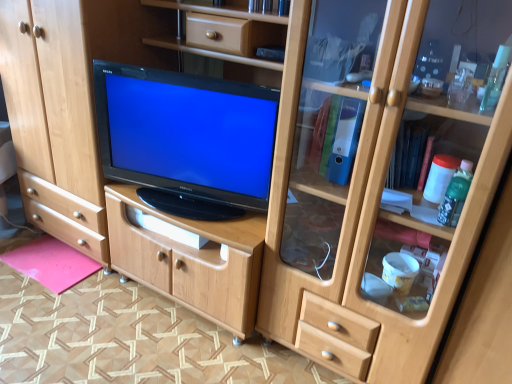
This screenshot has height=384, width=512. Identify the location of pink matte mat at lower left. (51, 263).

Describe the element at coordinates (51, 263) in the screenshot. I see `pink matte mat at lower left` at that location.

In order to click on black glossy television at center in this screenshot , I will do `click(186, 134)`.

Describe the element at coordinates (186, 134) in the screenshot. This screenshot has width=512, height=384. I see `black glossy television at center` at that location.

Locate an element on the screen. The image size is (512, 384). pink matte mat at lower left is located at coordinates (51, 263).

Is black glossy television at center to the left or to the right of pink matte mat at lower left in the image?

In the image, black glossy television at center appears on the right side of pink matte mat at lower left.

Based on the photo, considering the relative positions of black glossy television at center and pink matte mat at lower left in the image provided, is black glossy television at center behind pink matte mat at lower left?

No, it is in front of pink matte mat at lower left.

Is point (98, 126) closer or farther from the camera than point (63, 271)?

Point (98, 126).

From the image's perspective, between black glossy television at center and pink matte mat at lower left, which one is located above?

black glossy television at center appears higher in the image.

From a real-world perspective, which object rests below the other?

In real-world perspective, pink matte mat at lower left is lower.

Which object is thinner, black glossy television at center or pink matte mat at lower left?

black glossy television at center is thinner.

Considering the relative sizes of black glossy television at center and pink matte mat at lower left in the image provided, is black glossy television at center shorter than pink matte mat at lower left?

In fact, black glossy television at center may be taller than pink matte mat at lower left.

Considering the sizes of objects black glossy television at center and pink matte mat at lower left in the image provided, who is smaller, black glossy television at center or pink matte mat at lower left?

pink matte mat at lower left.

Is black glossy television at center located outside pink matte mat at lower left?

Yes, black glossy television at center is outside of pink matte mat at lower left.

Would you consider black glossy television at center to be distant from pink matte mat at lower left?

No, black glossy television at center is in close proximity to pink matte mat at lower left.

Looking at this image, could you tell me if black glossy television at center is turned towards pink matte mat at lower left?

No, black glossy television at center is not oriented towards pink matte mat at lower left.

What's the angular difference between black glossy television at center and pink matte mat at lower left's facing directions?

The facing directions of black glossy television at center and pink matte mat at lower left are 15.1 degrees apart.

Measure the distance between black glossy television at center and pink matte mat at lower left.

black glossy television at center is 34.89 inches away from pink matte mat at lower left.

In the image, there is a black glossy television at center. Identify the location of flat below it (from a real-world perspective). The width and height of the screenshot is (512, 384). (51, 263).

Which object is positioned more to the right, pink matte mat at lower left or black glossy television at center?

From the viewer's perspective, black glossy television at center appears more on the right side.

Based on the photo, does pink matte mat at lower left come in front of black glossy television at center?

No, it is behind black glossy television at center.

Does point (54, 292) come behind point (207, 117)?

That is True.

From the image's perspective, is pink matte mat at lower left above or below black glossy television at center?

Clearly, from the image's perspective, pink matte mat at lower left is below black glossy television at center.

From a real-world perspective, is pink matte mat at lower left over black glossy television at center?

No, from a real-world perspective, pink matte mat at lower left is not on top of black glossy television at center.

Considering the sizes of pink matte mat at lower left and black glossy television at center in the image, is pink matte mat at lower left wider or thinner than black glossy television at center?

Clearly, pink matte mat at lower left has more width compared to black glossy television at center.

Considering the relative sizes of pink matte mat at lower left and black glossy television at center in the image provided, is pink matte mat at lower left shorter than black glossy television at center?

Yes.

Based on the photo, considering the relative sizes of pink matte mat at lower left and black glossy television at center in the image provided, is pink matte mat at lower left bigger than black glossy television at center?

No.

Would you say pink matte mat at lower left contains black glossy television at center?

Actually, black glossy television at center is outside pink matte mat at lower left.

Is pink matte mat at lower left placed right next to black glossy television at center?

pink matte mat at lower left is not next to black glossy television at center, and they're not touching.

Is pink matte mat at lower left turned away from black glossy television at center?

No, pink matte mat at lower left is not facing away from black glossy television at center.

How many degrees apart are the facing directions of pink matte mat at lower left and black glossy television at center?

15.1 degrees.

Where is `television in front of the pink matte mat at lower left`? This screenshot has width=512, height=384. television in front of the pink matte mat at lower left is located at coordinates (186, 134).

Where is `television located above the pink matte mat at lower left (from the image's perspective)`? The width and height of the screenshot is (512, 384). television located above the pink matte mat at lower left (from the image's perspective) is located at coordinates (186, 134).

Locate an element on the screen. The height and width of the screenshot is (384, 512). television in front of the pink matte mat at lower left is located at coordinates (186, 134).